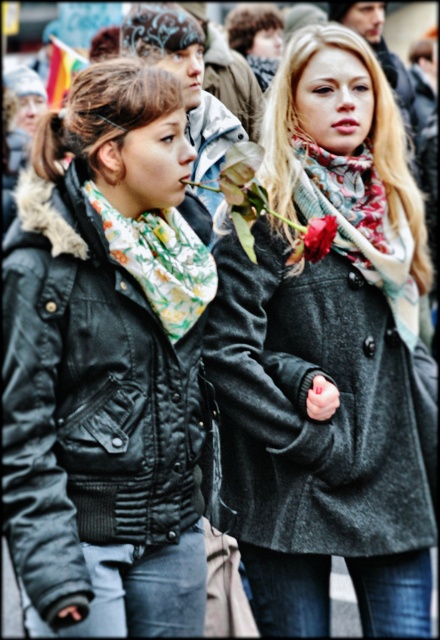
Question: Which of these objects is positioned farthest from the black leather jacket at left?

Choices:
 (A) floral print scarf at center
 (B) floral printed scarf at left

Answer: (A)

Question: Which point is closer to the camera?

Choices:
 (A) (388, 300)
 (B) (260, 435)
 (C) (195, 276)
 (D) (190, 429)

Answer: (B)

Question: Is black leather jacket at left thinner than floral printed scarf at left?

Choices:
 (A) no
 (B) yes

Answer: (A)

Question: Can you confirm if floral print scarf at center is positioned to the right of red matte flower at center?

Choices:
 (A) no
 (B) yes

Answer: (B)

Question: Which object is positioned closest to the floral printed scarf at left?

Choices:
 (A) floral print scarf at center
 (B) black leather jacket at left

Answer: (B)

Question: Is matte gray coat at center wider than floral print scarf at center?

Choices:
 (A) no
 (B) yes

Answer: (B)